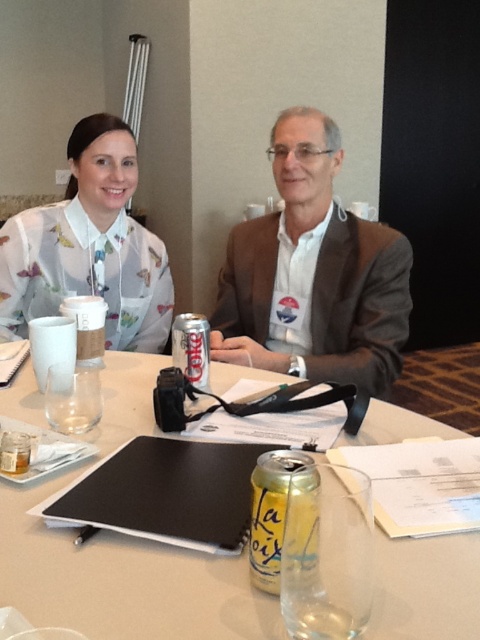
Question: Can you confirm if matte white blouse at upper left is smaller than yellow aluminum can at center?

Choices:
 (A) yes
 (B) no

Answer: (B)

Question: Based on their relative distances, which object is nearer to the clear glass water at center?

Choices:
 (A) yellow aluminum can at center
 (B) matte white blouse at upper left

Answer: (A)

Question: Is clear glass water at center positioned before yellow aluminum can at center?

Choices:
 (A) yes
 (B) no

Answer: (A)

Question: Does clear glass water at center appear under matte brown blazer at center?

Choices:
 (A) yes
 (B) no

Answer: (A)

Question: Estimate the real-world distances between objects in this image. Which object is closer to the translucent floral blouse at upper left?

Choices:
 (A) matte white blouse at upper left
 (B) matte brown blazer at center

Answer: (A)

Question: Which point is closer to the camera taking this photo?

Choices:
 (A) (10, 292)
 (B) (300, 208)
 (C) (20, 268)

Answer: (B)